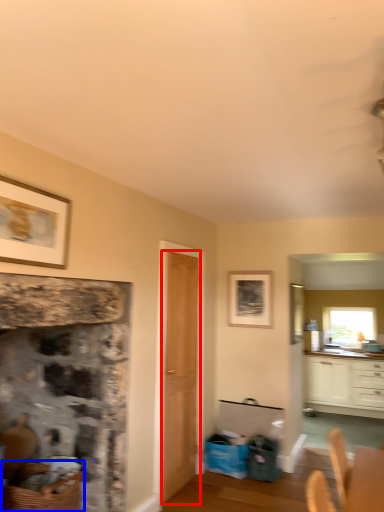
Question: Among these objects, which one is nearest to the camera, door (highlighted by a red box) or basket (highlighted by a blue box)?

Choices:
 (A) door
 (B) basket

Answer: (B)